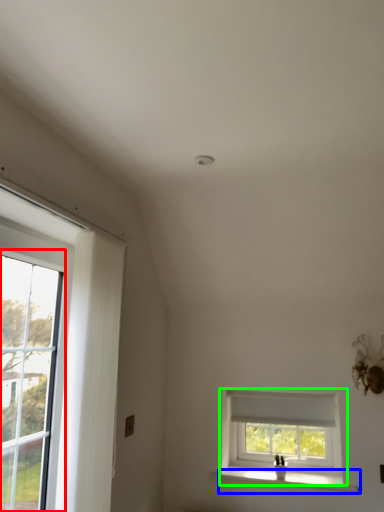
Question: Which is farther away from glass door (highlighted by a red box)? window sill (highlighted by a blue box) or window (highlighted by a green box)?

Choices:
 (A) window sill
 (B) window

Answer: (B)